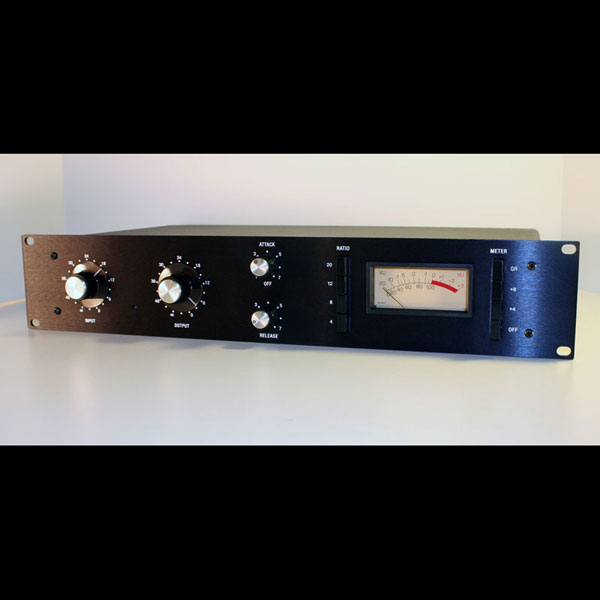
Locate an element on the screen. Image resolution: width=600 pixels, height=600 pixels. white table top is located at coordinates (473, 169).